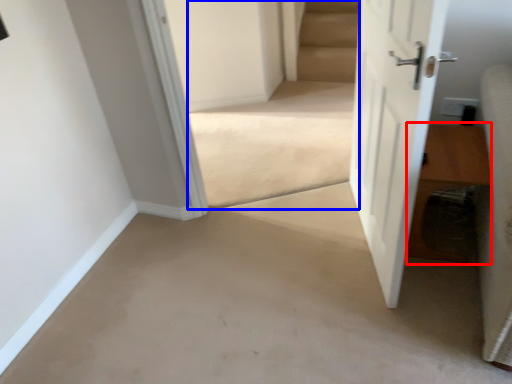
Question: Which point is closer to the camera, hardwood (highlighted by a red box) or stairwell (highlighted by a blue box)?

Choices:
 (A) hardwood
 (B) stairwell

Answer: (A)